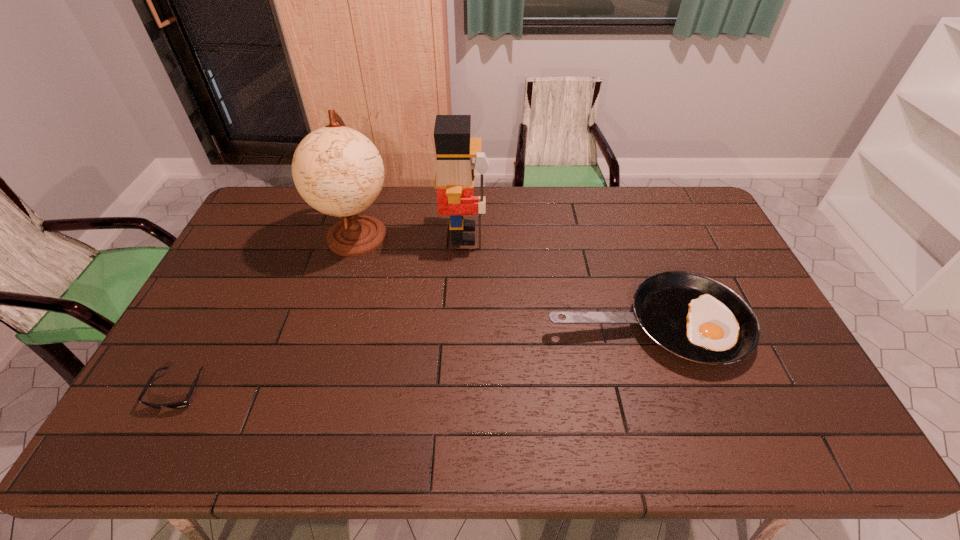
At what (x,y) coordinates should I click in order to perform the action: click on globe located at the far edge. Please return your answer as a coordinate pair (x, y). Looking at the image, I should click on (338, 171).

Find the location of `nutcracker that is at the far edge`. nutcracker that is at the far edge is located at coordinates (455, 172).

Identify the location of object that is at the left edge. tap(184, 403).

The image size is (960, 540). I want to click on object present at the right edge, so click(x=695, y=318).

The width and height of the screenshot is (960, 540). In order to click on vacant space at the far edge of the desktop in this screenshot , I will do `click(417, 192)`.

The width and height of the screenshot is (960, 540). In the image, there is a desktop. Find the location of `vacant space at the near edge`. vacant space at the near edge is located at coordinates (277, 425).

Locate an element on the screen. This screenshot has width=960, height=540. free space at the right edge of the desktop is located at coordinates (795, 366).

In the image, there is a desktop. Identify the location of free space at the far left corner. (296, 214).

You are a GUI agent. You are given a task and a screenshot of the screen. Output one action in this format:
    pyautogui.click(x=<x>, y=<y>)
    Task: Click on the free point between the globe and the frying pan
    This screenshot has height=540, width=960.
    Given the screenshot: What is the action you would take?
    pyautogui.click(x=502, y=280)

Where is `vacant space that's between the second object from right to left and the third tallest object`? vacant space that's between the second object from right to left and the third tallest object is located at coordinates (555, 280).